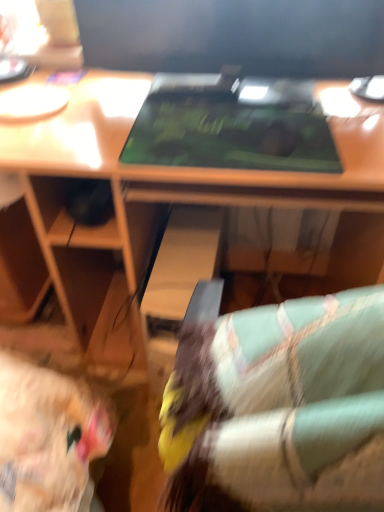
Find the location of a particular element. The height and width of the screenshot is (512, 384). matte black monitor at upper center is located at coordinates pyautogui.click(x=235, y=36).

What do you see at coordinates (235, 36) in the screenshot?
I see `matte black monitor at upper center` at bounding box center [235, 36].

What do you see at coordinates (231, 126) in the screenshot? Image resolution: width=384 pixels, height=512 pixels. I see `green matte laptop at center` at bounding box center [231, 126].

The width and height of the screenshot is (384, 512). I want to click on green matte laptop at center, so click(x=231, y=126).

The image size is (384, 512). Identify the location of matte black monitor at upper center. (235, 36).

Is matte black monitor at upper center to the right of green matte laptop at center from the viewer's perspective?

Yes, matte black monitor at upper center is to the right of green matte laptop at center.

Is the depth of matte black monitor at upper center less than that of green matte laptop at center?

No, matte black monitor at upper center is further to the viewer.

Which is more distant, [146,51] or [304,96]?

Positioned behind is point [146,51].

From the image's perspective, relative to green matte laptop at center, is matte black monitor at upper center above or below?

From the image's perspective, matte black monitor at upper center appears above green matte laptop at center.

From a real-world perspective, is matte black monitor at upper center beneath green matte laptop at center?

No.

Is matte black monitor at upper center thinner than green matte laptop at center?

Yes, matte black monitor at upper center is thinner than green matte laptop at center.

Can you confirm if matte black monitor at upper center is taller than green matte laptop at center?

Indeed, matte black monitor at upper center has a greater height compared to green matte laptop at center.

Can you confirm if matte black monitor at upper center is bigger than green matte laptop at center?

Correct, matte black monitor at upper center is larger in size than green matte laptop at center.

Can we say matte black monitor at upper center lies outside green matte laptop at center?

Yes.

Is the surface of matte black monitor at upper center in direct contact with green matte laptop at center?

No, matte black monitor at upper center is not touching green matte laptop at center.

Is matte black monitor at upper center looking in the opposite direction of green matte laptop at center?

No.

What's the angular difference between matte black monitor at upper center and green matte laptop at center's facing directions?

There is a 0.156-degree angle between the facing directions of matte black monitor at upper center and green matte laptop at center.

The image size is (384, 512). Find the location of `laptop located on the left of matte black monitor at upper center`. laptop located on the left of matte black monitor at upper center is located at coordinates (231, 126).

Which is more to the left, green matte laptop at center or matte black monitor at upper center?

green matte laptop at center.

Is green matte laptop at center in front of matte black monitor at upper center?

Yes, the depth of green matte laptop at center is less than that of matte black monitor at upper center.

Between point (243, 164) and point (93, 39), which one is positioned in front?

The point (243, 164) is closer.

From the image's perspective, is green matte laptop at center below matte black monitor at upper center?

Yes, from the image's perspective, green matte laptop at center is below matte black monitor at upper center.

From a real-world perspective, is green matte laptop at center positioned over matte black monitor at upper center based on gravity?

Incorrect, from a real-world perspective, green matte laptop at center is lower than matte black monitor at upper center.

Is green matte laptop at center thinner than matte black monitor at upper center?

No.

Between green matte laptop at center and matte black monitor at upper center, which one has more height?

With more height is matte black monitor at upper center.

Which of these two, green matte laptop at center or matte black monitor at upper center, is smaller?

green matte laptop at center is smaller.

Is matte black monitor at upper center a part of green matte laptop at center?

No, matte black monitor at upper center is not surrounded by green matte laptop at center.

Is green matte laptop at center far away from matte black monitor at upper center?

No.

Could you tell me if green matte laptop at center is facing matte black monitor at upper center?

No, green matte laptop at center is not oriented towards matte black monitor at upper center.

Can you tell me how much green matte laptop at center and matte black monitor at upper center differ in facing direction?

They differ by 0.156 degrees in their facing directions.

Where is `laptop below the matte black monitor at upper center (from a real-world perspective)`? laptop below the matte black monitor at upper center (from a real-world perspective) is located at coordinates (231, 126).

Locate an element on the screen. The height and width of the screenshot is (512, 384). computer monitor above the green matte laptop at center (from the image's perspective) is located at coordinates (235, 36).

Locate an element on the screen. The image size is (384, 512). laptop in front of the matte black monitor at upper center is located at coordinates click(231, 126).